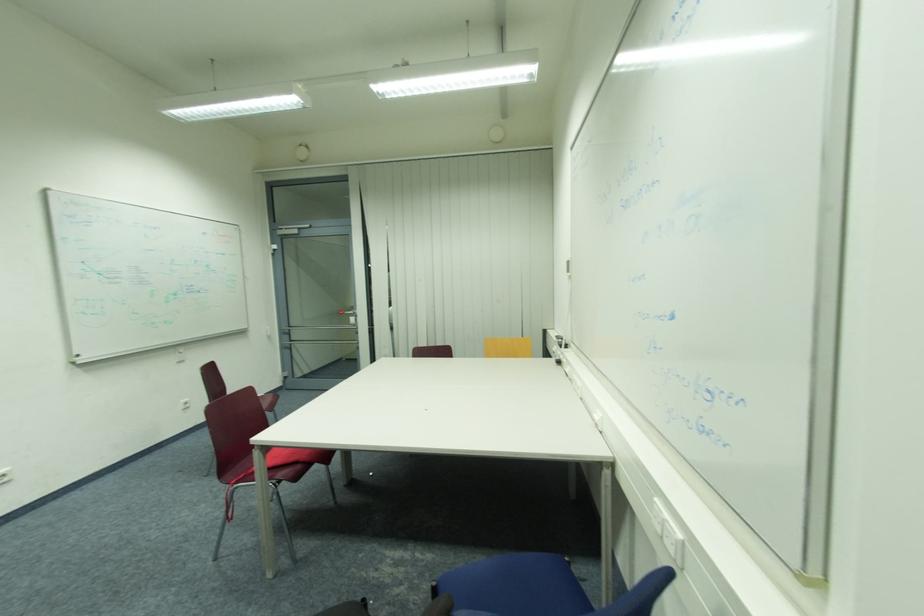
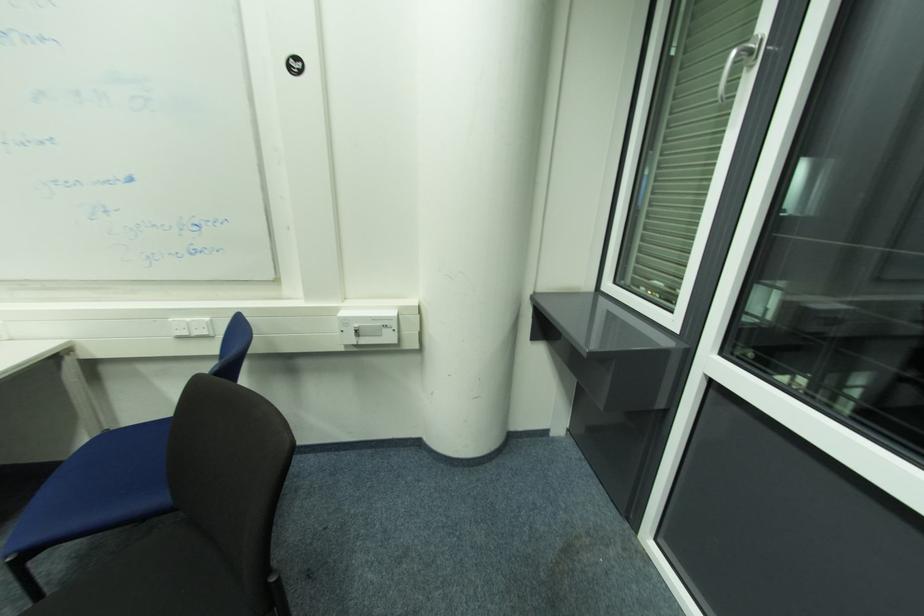
In the second image, find the point that corresponds to [670,516] in the first image.

(191, 320)